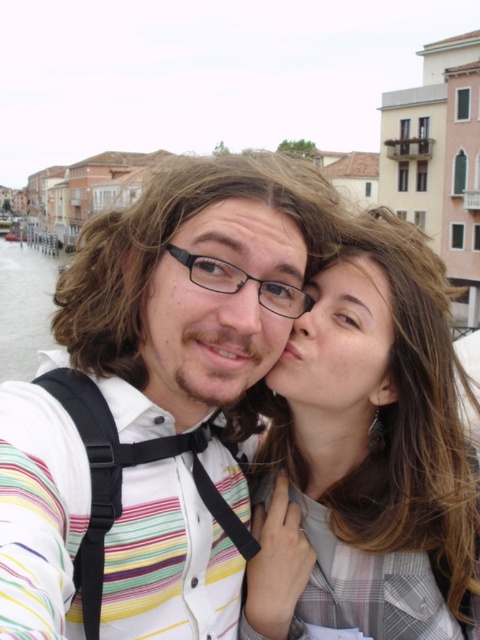
Question: Is smooth brown hair at center bigger than smooth skin face at center?

Choices:
 (A) no
 (B) yes

Answer: (B)

Question: Which object appears farthest from the camera in this image?

Choices:
 (A) matte black glasses at center
 (B) black plastic glasses at center

Answer: (B)

Question: Which point appears farthest from the camera in this image?

Choices:
 (A) (162, 358)
 (B) (362, 340)
 (C) (240, 272)
 (D) (432, 532)

Answer: (B)

Question: Which object appears closest to the camera in this image?

Choices:
 (A) smooth brown hair at center
 (B) black plastic glasses at center

Answer: (A)

Question: Is smooth brown hair at center thinner than black plastic glasses at center?

Choices:
 (A) no
 (B) yes

Answer: (A)

Question: Is matte black glasses at center smaller than black plastic glasses at center?

Choices:
 (A) no
 (B) yes

Answer: (A)